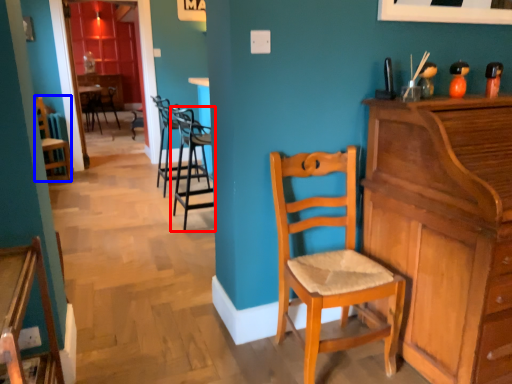
Question: Among these objects, which one is nearest to the camera, chair (highlighted by a red box) or chair (highlighted by a blue box)?

Choices:
 (A) chair
 (B) chair

Answer: (A)